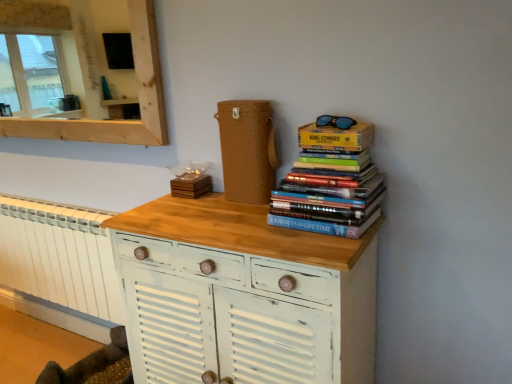
Question: Does wooden coaster at center, positioned as the first paperback book in left-to-right order, have a smaller size compared to wooden mirror at upper left?

Choices:
 (A) yes
 (B) no

Answer: (A)

Question: From the image's perspective, is wooden coaster at center, arranged as the 2th paperback book when viewed from the top, on wooden mirror at upper left?

Choices:
 (A) no
 (B) yes

Answer: (A)

Question: Is wooden coaster at center, which is the second paperback book from right to left, behind wooden mirror at upper left?

Choices:
 (A) yes
 (B) no

Answer: (A)

Question: Considering the relative sizes of wooden coaster at center, the 1th paperback book ordered from the bottom, and wooden mirror at upper left in the image provided, is wooden coaster at center, the 1th paperback book ordered from the bottom, thinner than wooden mirror at upper left?

Choices:
 (A) yes
 (B) no

Answer: (A)

Question: From a real-world perspective, is wooden coaster at center, acting as the second paperback book starting from the front, physically above wooden mirror at upper left?

Choices:
 (A) yes
 (B) no

Answer: (B)

Question: Considering their positions, is wooden mirror at upper left located in front of or behind wooden coaster at center, acting as the 1th paperback book starting from the back?

Choices:
 (A) behind
 (B) front

Answer: (B)

Question: From a real-world perspective, relative to wooden coaster at center, arranged as the 2th paperback book when viewed from the top, is wooden mirror at upper left vertically above or below?

Choices:
 (A) above
 (B) below

Answer: (A)

Question: Considering the positions of wooden mirror at upper left and wooden coaster at center, acting as the second paperback book starting from the front, in the image, is wooden mirror at upper left wider or thinner than wooden coaster at center, acting as the second paperback book starting from the front,?

Choices:
 (A) thin
 (B) wide

Answer: (B)

Question: Looking at the image, does wooden mirror at upper left seem bigger or smaller compared to wooden coaster at center, arranged as the 2th paperback book when viewed from the top?

Choices:
 (A) big
 (B) small

Answer: (A)

Question: From the image's perspective, relative to wooden mirror at upper left, is white painted radiator at lower left above or below?

Choices:
 (A) above
 (B) below

Answer: (B)

Question: Looking at their shapes, would you say white painted radiator at lower left is wider or thinner than wooden mirror at upper left?

Choices:
 (A) thin
 (B) wide

Answer: (B)

Question: In the image, is white painted radiator at lower left on the left side or the right side of wooden mirror at upper left?

Choices:
 (A) left
 (B) right

Answer: (A)

Question: Considering their positions, is white painted radiator at lower left located in front of or behind wooden mirror at upper left?

Choices:
 (A) behind
 (B) front

Answer: (A)

Question: Looking at their shapes, would you say blue reflective lenses at upper right is wider or thinner than white distressed wood chest of drawers at center?

Choices:
 (A) wide
 (B) thin

Answer: (B)

Question: From the image's perspective, is blue reflective lenses at upper right positioned above or below white distressed wood chest of drawers at center?

Choices:
 (A) above
 (B) below

Answer: (A)